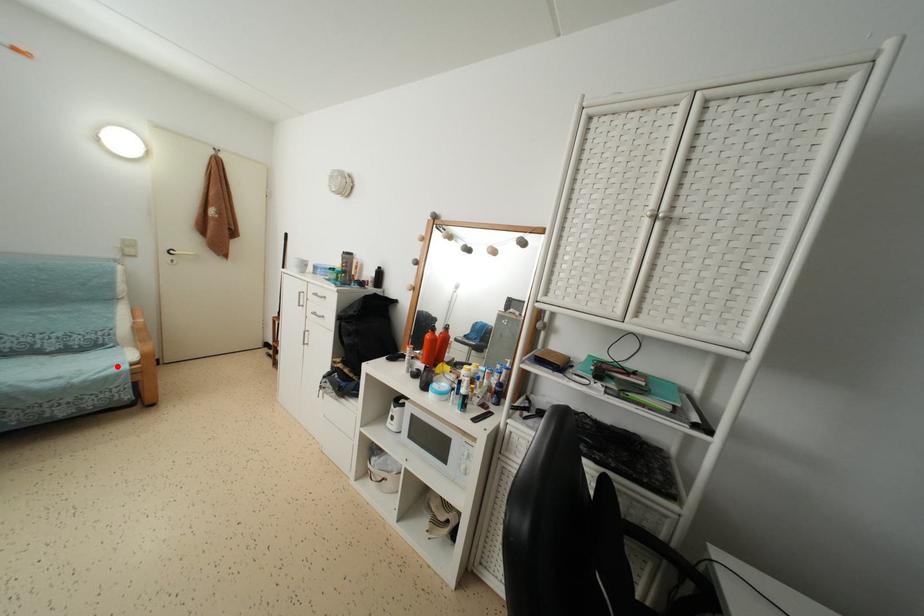
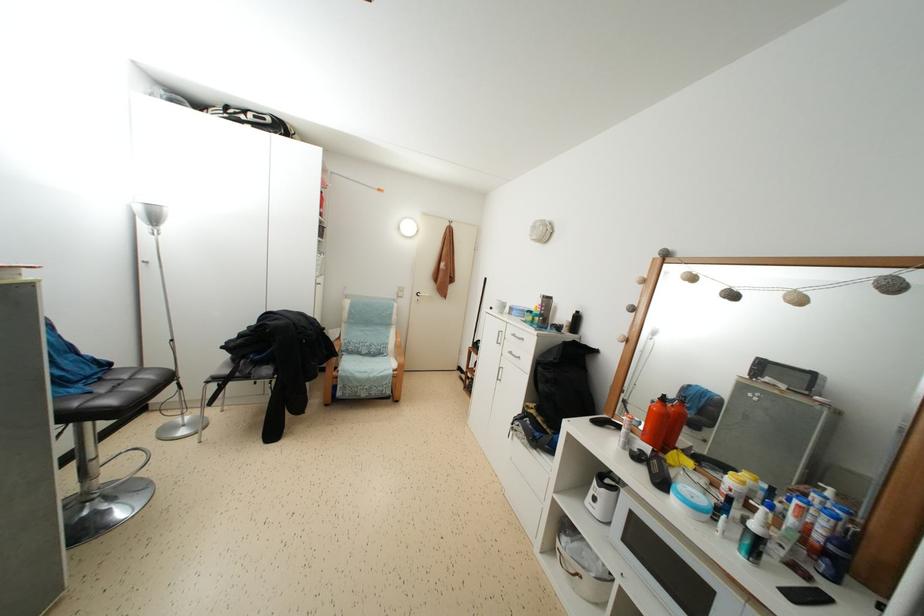
Question: I am providing you with two images of the same scene from different viewpoints. In image1, a red point is highlighted. Considering the same 3D point in image2, which of the following is correct?

Choices:
 (A) It is closer
 (B) It is farther

Answer: (B)